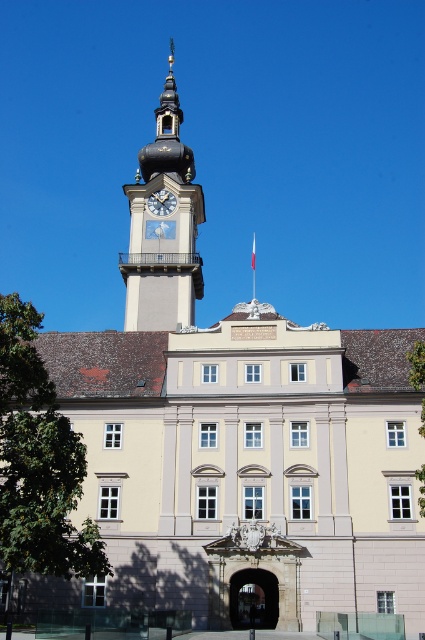
Question: Does gold-plated clock tower at upper center come behind white painted clock at upper center?

Choices:
 (A) yes
 (B) no

Answer: (B)

Question: Which point is farther from the camera taking this photo?

Choices:
 (A) (173, 228)
 (B) (159, 202)

Answer: (B)

Question: Which object is closer to the camera taking this photo?

Choices:
 (A) gold-plated clock tower at upper center
 (B) green leafy tree at lower left
 (C) white painted clock at upper center

Answer: (B)

Question: Does gold-plated clock tower at upper center appear under white painted clock at upper center?

Choices:
 (A) yes
 (B) no

Answer: (B)

Question: Is green leafy tree at lower left to the right of white painted clock at upper center from the viewer's perspective?

Choices:
 (A) no
 (B) yes

Answer: (A)

Question: Which point appears closest to the camera in this image?

Choices:
 (A) (90, 534)
 (B) (155, 160)
 (C) (164, 212)

Answer: (A)